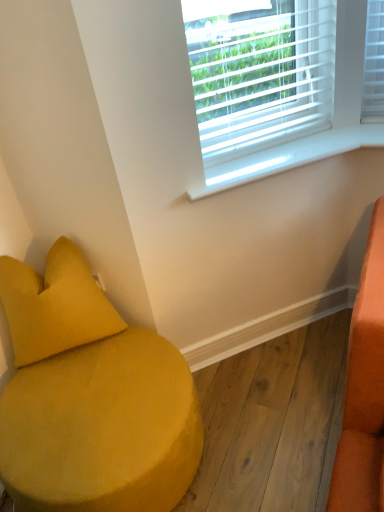
Question: Would you consider velvet yellow ottoman at lower left to be distant from white plastic window sill at upper center?

Choices:
 (A) no
 (B) yes

Answer: (A)

Question: Considering the relative positions of velvet yellow ottoman at lower left and white plastic window sill at upper center in the image provided, is velvet yellow ottoman at lower left to the right of white plastic window sill at upper center from the viewer's perspective?

Choices:
 (A) yes
 (B) no

Answer: (B)

Question: Is velvet yellow ottoman at lower left facing towards white plastic window sill at upper center?

Choices:
 (A) no
 (B) yes

Answer: (A)

Question: Is velvet yellow ottoman at lower left at the left side of white plastic window sill at upper center?

Choices:
 (A) no
 (B) yes

Answer: (B)

Question: From a real-world perspective, is velvet yellow ottoman at lower left positioned under white plastic window sill at upper center based on gravity?

Choices:
 (A) no
 (B) yes

Answer: (B)

Question: From a real-world perspective, relative to matte yellow pillow at lower left, is velvet yellow ottoman at lower left vertically above or below?

Choices:
 (A) above
 (B) below

Answer: (B)

Question: Looking at their shapes, would you say velvet yellow ottoman at lower left is wider or thinner than matte yellow pillow at lower left?

Choices:
 (A) wide
 (B) thin

Answer: (A)

Question: Considering the positions of point (142, 484) and point (18, 298), is point (142, 484) closer or farther from the camera than point (18, 298)?

Choices:
 (A) farther
 (B) closer

Answer: (B)

Question: Relative to matte yellow pillow at lower left, is velvet yellow ottoman at lower left in front or behind?

Choices:
 (A) behind
 (B) front

Answer: (B)

Question: In terms of size, does white plastic blinds at upper center appear bigger or smaller than matte yellow pillow at lower left?

Choices:
 (A) big
 (B) small

Answer: (B)

Question: From a real-world perspective, is white plastic blinds at upper center physically located above or below matte yellow pillow at lower left?

Choices:
 (A) below
 (B) above

Answer: (B)

Question: Is point (x=226, y=32) positioned closer to the camera than point (x=44, y=350)?

Choices:
 (A) farther
 (B) closer

Answer: (A)

Question: Is white plastic blinds at upper center in front of or behind matte yellow pillow at lower left in the image?

Choices:
 (A) behind
 (B) front

Answer: (A)

Question: From a real-world perspective, is white plastic blinds at upper center positioned above or below velvet yellow ottoman at lower left?

Choices:
 (A) below
 (B) above

Answer: (B)

Question: Is white plastic blinds at upper center situated inside velvet yellow ottoman at lower left or outside?

Choices:
 (A) outside
 (B) inside

Answer: (A)